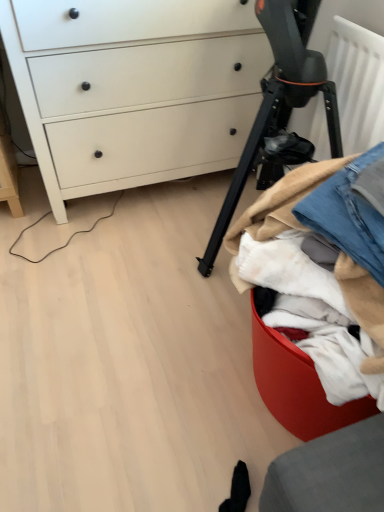
I want to click on free space that is in between white matte chest of drawers at upper left and black matte tripod at center, so click(144, 250).